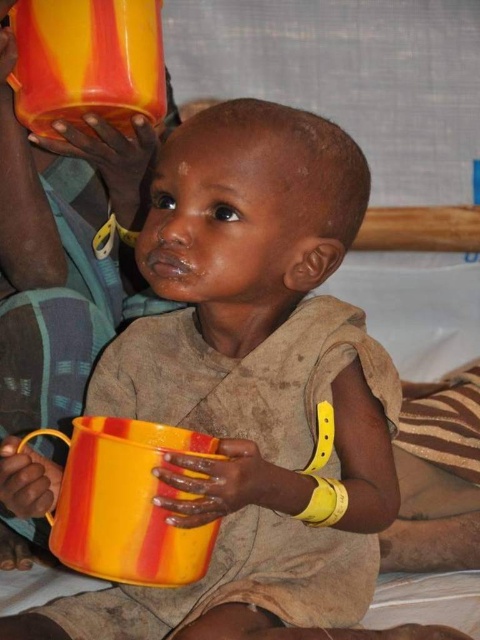
You are a delivery person standing 30 inches away from a yellow striped mug at center. Can you reach it without moving closer?

The yellow striped mug at center is 32.54 inches away from the viewer. Since you are 30 inches away, you are closer than the stated distance, so you can reach it.